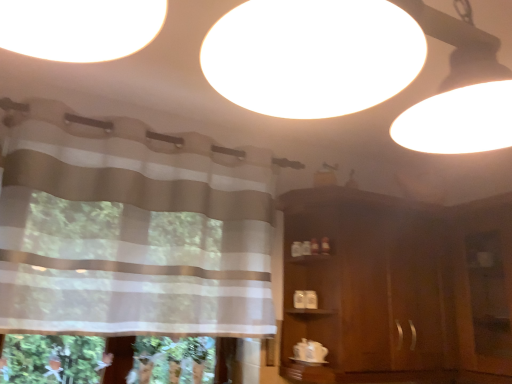
Question: Is transparent plastic screen door at right not inside brown wooden dresser at right?

Choices:
 (A) yes
 (B) no

Answer: (A)

Question: Can you confirm if transparent plastic screen door at right is positioned to the right of brown wooden dresser at right?

Choices:
 (A) yes
 (B) no

Answer: (A)

Question: From the image's perspective, does transparent plastic screen door at right appear lower than brown wooden dresser at right?

Choices:
 (A) yes
 (B) no

Answer: (A)

Question: Is transparent plastic screen door at right thinner than brown wooden dresser at right?

Choices:
 (A) no
 (B) yes

Answer: (B)

Question: Is the position of transparent plastic screen door at right less distant than that of brown wooden dresser at right?

Choices:
 (A) no
 (B) yes

Answer: (B)

Question: From a real-world perspective, is striped fabric curtain at upper left above or below brown wooden dresser at right?

Choices:
 (A) below
 (B) above

Answer: (B)

Question: Looking at the image, does striped fabric curtain at upper left seem bigger or smaller compared to brown wooden dresser at right?

Choices:
 (A) big
 (B) small

Answer: (B)

Question: Is striped fabric curtain at upper left inside the boundaries of brown wooden dresser at right, or outside?

Choices:
 (A) inside
 (B) outside

Answer: (B)

Question: Is striped fabric curtain at upper left taller or shorter than brown wooden dresser at right?

Choices:
 (A) short
 (B) tall

Answer: (A)

Question: Based on their positions, is brown wooden dresser at right located to the left or right of transparent plastic screen door at right?

Choices:
 (A) right
 (B) left

Answer: (B)

Question: Is brown wooden dresser at right taller or shorter than transparent plastic screen door at right?

Choices:
 (A) short
 (B) tall

Answer: (B)

Question: Does point (387, 221) appear closer or farther from the camera than point (486, 231)?

Choices:
 (A) farther
 (B) closer

Answer: (B)

Question: Considering the positions of brown wooden dresser at right and transparent plastic screen door at right in the image, is brown wooden dresser at right wider or thinner than transparent plastic screen door at right?

Choices:
 (A) wide
 (B) thin

Answer: (A)

Question: Is point (474, 337) positioned closer to the camera than point (13, 316)?

Choices:
 (A) farther
 (B) closer

Answer: (A)

Question: Is transparent plastic screen door at right spatially inside striped fabric curtain at upper left, or outside of it?

Choices:
 (A) outside
 (B) inside

Answer: (A)